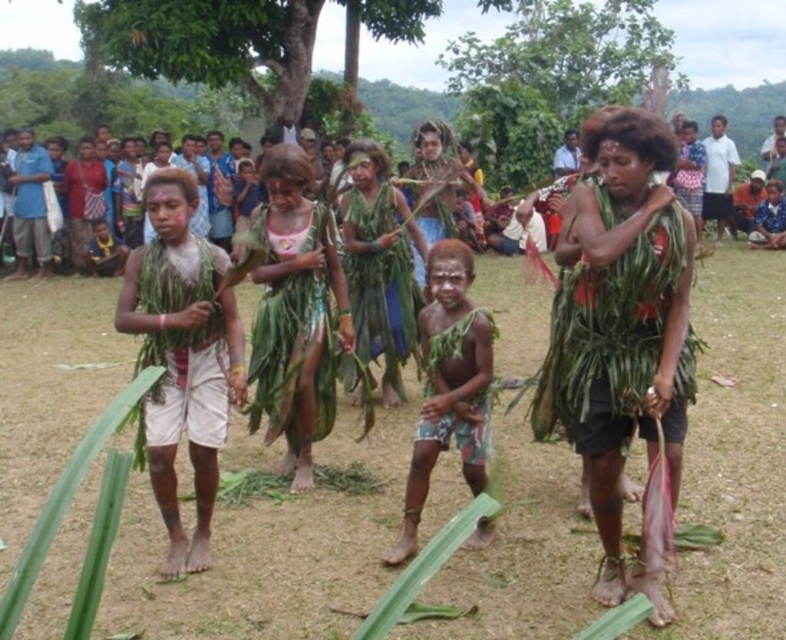
Describe the element at coordinates (270, 550) in the screenshot. This screenshot has width=786, height=640. I see `green leafy grass at center` at that location.

From the picture: Can you confirm if green leafy grass at center is smaller than brown textured cloth at center?

No, green leafy grass at center is not smaller than brown textured cloth at center.

Is point (505, 400) in front of point (421, 476)?

No, (505, 400) is behind (421, 476).

The width and height of the screenshot is (786, 640). I want to click on green leafy grass at center, so click(270, 550).